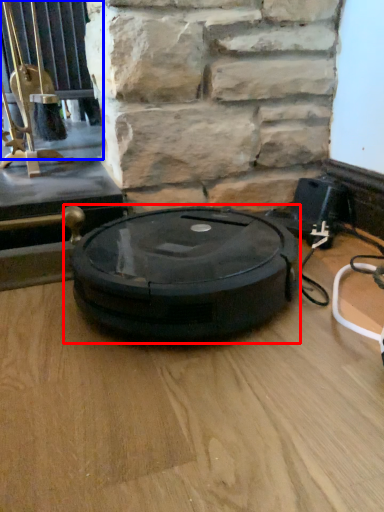
Question: Which of the following is the farthest to the observer, weight scale (highlighted by a red box) or window (highlighted by a blue box)?

Choices:
 (A) weight scale
 (B) window

Answer: (B)